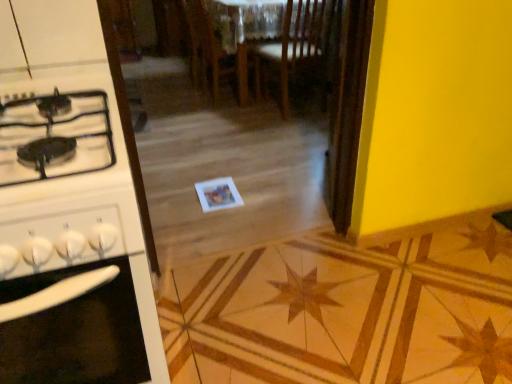
In order to face white glossy stove at left, should I rotate leftwards or rightwards?

Rotate left and turn 25.123 degrees.

This screenshot has width=512, height=384. In order to click on wooden chair at center, acting as the second chair starting from the right in this screenshot , I will do `click(208, 43)`.

Identify the location of white glossy stove at left. (71, 206).

Which of these two, wooden chair at center, which is the 1th chair in right-to-left order, or wooden screen door at center, stands taller?

Standing taller between the two is wooden screen door at center.

Which object is closer to the camera, wooden chair at center, which is the second chair from left to right, or wooden screen door at center?

wooden screen door at center is more forward.

In the scene shown: Is wooden chair at center, which is the second chair from left to right, smaller than wooden screen door at center?

Actually, wooden chair at center, which is the second chair from left to right, might be larger than wooden screen door at center.

Does wooden chair at center, which is the 1th chair in right-to-left order, have a greater width compared to wooden screen door at center?

Yes, wooden chair at center, which is the 1th chair in right-to-left order, is wider than wooden screen door at center.

Consider the image. Is wooden chair at center, acting as the second chair starting from the right, directly adjacent to wooden chair at center, which is the second chair from left to right?

No.

From the image's perspective, is wooden chair at center, acting as the second chair starting from the right, over wooden chair at center, which is the second chair from left to right?

Yes, from the image's perspective, wooden chair at center, acting as the second chair starting from the right, is over wooden chair at center, which is the second chair from left to right.

Is point (244, 55) positioned behind point (280, 54)?

Yes, point (244, 55) is behind point (280, 54).

Where is `screen door on the right of white glossy stove at left`? screen door on the right of white glossy stove at left is located at coordinates (347, 110).

In terms of width, does white glossy stove at left look wider or thinner when compared to wooden screen door at center?

In the image, white glossy stove at left appears to be wider than wooden screen door at center.

From the image's perspective, does white glossy stove at left appear higher than wooden screen door at center?

Incorrect, from the image's perspective, white glossy stove at left is lower than wooden screen door at center.

From the picture: Considering the sizes of white glossy stove at left and wooden screen door at center in the image, is white glossy stove at left bigger or smaller than wooden screen door at center?

In the image, white glossy stove at left appears to be larger than wooden screen door at center.

Is wooden screen door at center facing away from wooden chair at center, which is the 1th chair in right-to-left order?

wooden screen door at center does not have its back to wooden chair at center, which is the 1th chair in right-to-left order.

From the image's perspective, would you say wooden screen door at center is shown under wooden chair at center, which is the second chair from left to right?

Yes, from the image's perspective, wooden screen door at center is below wooden chair at center, which is the second chair from left to right.

Considering the sizes of objects wooden screen door at center and wooden chair at center, which is the 1th chair in right-to-left order, in the image provided, who is wider, wooden screen door at center or wooden chair at center, which is the 1th chair in right-to-left order,?

Wider between the two is wooden chair at center, which is the 1th chair in right-to-left order.

Considering the relative positions of wooden screen door at center and wooden chair at center, which is the 1th chair in right-to-left order, in the image provided, is wooden screen door at center in front of wooden chair at center, which is the 1th chair in right-to-left order,?

Yes, wooden screen door at center is closer to the camera.

In terms of size, does wooden screen door at center appear bigger or smaller than white glossy stove at left?

wooden screen door at center is smaller than white glossy stove at left.

Where is `kitchen appliance below the wooden screen door at center (from a real-world perspective)`? This screenshot has height=384, width=512. kitchen appliance below the wooden screen door at center (from a real-world perspective) is located at coordinates (71, 206).

From the image's perspective, would you say wooden screen door at center is positioned over white glossy stove at left?

Yes.

From a real-world perspective, which object rests below the other?

white glossy stove at left, from a real-world perspective.

Measure the distance between wooden chair at center, which is counted as the 1th chair, starting from the left, and wooden screen door at center.

wooden chair at center, which is counted as the 1th chair, starting from the left, and wooden screen door at center are 1.78 meters apart from each other.

Is wooden chair at center, acting as the second chair starting from the right, in front of wooden screen door at center?

No, wooden chair at center, acting as the second chair starting from the right, is further to the viewer.

Which of these two, wooden chair at center, acting as the second chair starting from the right, or wooden screen door at center, stands taller?

With more height is wooden screen door at center.

Would you say wooden screen door at center is part of wooden chair at center, which is counted as the 1th chair, starting from the left,'s contents?

Actually, wooden screen door at center is outside wooden chair at center, which is counted as the 1th chair, starting from the left.

Is wooden screen door at center not close to wooden chair at center, which is counted as the 1th chair, starting from the left?

Yes.

Is wooden chair at center, acting as the second chair starting from the right, located within wooden screen door at center?

Definitely not — wooden chair at center, acting as the second chair starting from the right, is not inside wooden screen door at center.

Is wooden chair at center, acting as the second chair starting from the right, at the back of wooden screen door at center?

wooden screen door at center is not turned away from wooden chair at center, acting as the second chair starting from the right.

Considering the relative sizes of wooden screen door at center and wooden chair at center, which is counted as the 1th chair, starting from the left, in the image provided, is wooden screen door at center thinner than wooden chair at center, which is counted as the 1th chair, starting from the left,?

Yes.

Identify the location of screen door in front of the wooden chair at center, which is the 1th chair in right-to-left order. (347, 110).

This screenshot has height=384, width=512. In the image, there is a wooden chair at center, which is the second chair from left to right. What are the coordinates of `chair below it (from a real-world perspective)` in the screenshot? It's located at (208, 43).

Looking at the image, which one is located closer to wooden chair at center, which is the 1th chair in right-to-left order, wooden screen door at center or white glossy stove at left?

wooden screen door at center lies closer to wooden chair at center, which is the 1th chair in right-to-left order, than the other object.

Based on their spatial positions, is wooden chair at center, which is counted as the 1th chair, starting from the left, or white glossy stove at left closer to wooden chair at center, which is the 1th chair in right-to-left order?

wooden chair at center, which is counted as the 1th chair, starting from the left, lies closer to wooden chair at center, which is the 1th chair in right-to-left order, than the other object.

When comparing their distances from wooden chair at center, which is the 1th chair in right-to-left order, does wooden chair at center, which is counted as the 1th chair, starting from the left, or wooden screen door at center seem further?

wooden screen door at center.

Considering their positions, is wooden screen door at center positioned closer to white glossy stove at left than wooden chair at center, which is counted as the 1th chair, starting from the left?

wooden screen door at center.

When comparing their distances from wooden screen door at center, does wooden chair at center, which is counted as the 1th chair, starting from the left, or wooden chair at center, which is the second chair from left to right, seem closer?

Based on the image, wooden chair at center, which is the second chair from left to right, appears to be nearer to wooden screen door at center.

Looking at the image, which one is located closer to wooden screen door at center, wooden chair at center, which is the 1th chair in right-to-left order, or wooden chair at center, which is counted as the 1th chair, starting from the left?

wooden chair at center, which is the 1th chair in right-to-left order.

Which object lies nearer to the anchor point wooden chair at center, which is counted as the 1th chair, starting from the left, wooden screen door at center or white glossy stove at left?

Among the two, wooden screen door at center is located nearer to wooden chair at center, which is counted as the 1th chair, starting from the left.

Estimate the real-world distances between objects in this image. Which object is closer to white glossy stove at left, wooden chair at center, which is the 1th chair in right-to-left order, or wooden screen door at center?

The object closer to white glossy stove at left is wooden screen door at center.

This screenshot has height=384, width=512. In order to click on screen door located between white glossy stove at left and wooden chair at center, acting as the second chair starting from the right, in the depth direction in this screenshot , I will do click(x=347, y=110).

Locate an element on the screen. chair positioned between white glossy stove at left and wooden chair at center, which is counted as the 1th chair, starting from the left, from near to far is located at coordinates (294, 46).

Where is `screen door between white glossy stove at left and wooden chair at center, which is the second chair from left to right, in the front-back direction`? The width and height of the screenshot is (512, 384). screen door between white glossy stove at left and wooden chair at center, which is the second chair from left to right, in the front-back direction is located at coordinates (347, 110).

Identify the location of chair positioned between wooden screen door at center and wooden chair at center, which is counted as the 1th chair, starting from the left, from near to far. Image resolution: width=512 pixels, height=384 pixels. (294, 46).